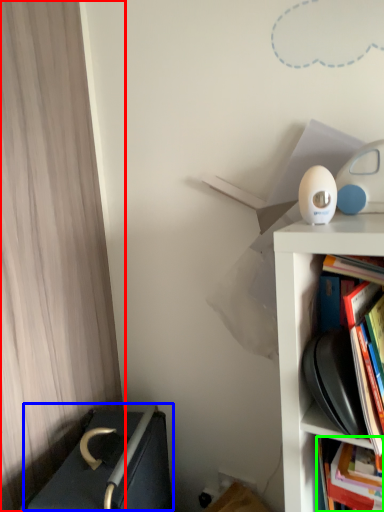
Question: Considering the real-world distances, which object is farthest from curtain (highlighted by a red box)? writing (highlighted by a blue box) or book (highlighted by a green box)?

Choices:
 (A) writing
 (B) book

Answer: (B)